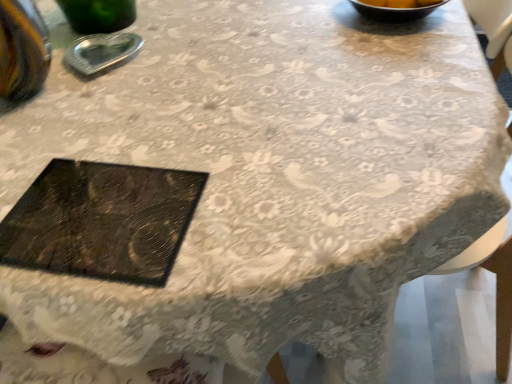
The width and height of the screenshot is (512, 384). Describe the element at coordinates (102, 221) in the screenshot. I see `black textured tray at center` at that location.

Where is `black textured tray at center`? The height and width of the screenshot is (384, 512). black textured tray at center is located at coordinates (102, 221).

What is the approximate height of black textured tray at center?

black textured tray at center is 0.68 inches in height.

The image size is (512, 384). I want to click on metallic silver ashtray at upper left, so click(x=101, y=51).

Describe the element at coordinates (101, 51) in the screenshot. The height and width of the screenshot is (384, 512). I see `metallic silver ashtray at upper left` at that location.

I want to click on black textured tray at center, so click(102, 221).

Looking at this image, between black textured tray at center and metallic silver ashtray at upper left, which one appears on the right side from the viewer's perspective?

black textured tray at center.

Which object is closer to the camera taking this photo, black textured tray at center or metallic silver ashtray at upper left?

black textured tray at center is in front.

Which is closer, [71,175] or [114,55]?

Point [71,175] is positioned closer to the camera compared to point [114,55].

From the image's perspective, which object appears higher, black textured tray at center or metallic silver ashtray at upper left?

metallic silver ashtray at upper left appears higher in the image.

From a real-world perspective, which is physically above, black textured tray at center or metallic silver ashtray at upper left?

metallic silver ashtray at upper left.

Which of these two, black textured tray at center or metallic silver ashtray at upper left, is wider?

With larger width is black textured tray at center.

From the picture: Considering the sizes of objects black textured tray at center and metallic silver ashtray at upper left in the image provided, who is taller, black textured tray at center or metallic silver ashtray at upper left?

With more height is metallic silver ashtray at upper left.

Which of these two, black textured tray at center or metallic silver ashtray at upper left, is bigger?

black textured tray at center.

Is black textured tray at center located outside metallic silver ashtray at upper left?

black textured tray at center is positioned outside metallic silver ashtray at upper left.

Is black textured tray at center positioned far away from metallic silver ashtray at upper left?

No, black textured tray at center is not far from metallic silver ashtray at upper left.

Could you tell me if black textured tray at center is turned towards metallic silver ashtray at upper left?

Yes, black textured tray at center is turned towards metallic silver ashtray at upper left.

Measure the distance from black textured tray at center to metallic silver ashtray at upper left.

A distance of 17.10 inches exists between black textured tray at center and metallic silver ashtray at upper left.

Where is `tray in front of the metallic silver ashtray at upper left`? This screenshot has height=384, width=512. tray in front of the metallic silver ashtray at upper left is located at coordinates (102, 221).

Which is more to the left, metallic silver ashtray at upper left or black textured tray at center?

metallic silver ashtray at upper left is more to the left.

Which is behind, metallic silver ashtray at upper left or black textured tray at center?

Positioned behind is metallic silver ashtray at upper left.

Is point (79, 64) closer to camera compared to point (114, 221)?

That is False.

From the image's perspective, is metallic silver ashtray at upper left under black textured tray at center?

Actually, metallic silver ashtray at upper left appears above black textured tray at center in the image.

From a real-world perspective, is metallic silver ashtray at upper left under black textured tray at center?

No, from a real-world perspective, metallic silver ashtray at upper left is not under black textured tray at center.

Is metallic silver ashtray at upper left wider than black textured tray at center?

No.

Is metallic silver ashtray at upper left taller or shorter than black textured tray at center?

In the image, metallic silver ashtray at upper left appears to be taller than black textured tray at center.

Considering the sizes of objects metallic silver ashtray at upper left and black textured tray at center in the image provided, who is smaller, metallic silver ashtray at upper left or black textured tray at center?

Smaller between the two is metallic silver ashtray at upper left.

Would you say black textured tray at center is part of metallic silver ashtray at upper left's contents?

No, black textured tray at center is located outside of metallic silver ashtray at upper left.

Is metallic silver ashtray at upper left far from black textured tray at center?

That's not correct — metallic silver ashtray at upper left is a little close to black textured tray at center.

Is metallic silver ashtray at upper left facing towards black textured tray at center?

No, metallic silver ashtray at upper left is not oriented towards black textured tray at center.

How different are the orientations of metallic silver ashtray at upper left and black textured tray at center in degrees?

The angle between the facing direction of metallic silver ashtray at upper left and the facing direction of black textured tray at center is 85.3 degrees.

How much distance is there between metallic silver ashtray at upper left and black textured tray at center?

metallic silver ashtray at upper left is 17.10 inches away from black textured tray at center.

You are a GUI agent. You are given a task and a screenshot of the screen. Output one action in this format:
    pyautogui.click(x=<x>, y=<y>)
    Task: Click on the tray on the right of the metallic silver ashtray at upper left
    The width and height of the screenshot is (512, 384).
    Given the screenshot: What is the action you would take?
    102,221

This screenshot has height=384, width=512. In the image, there is a black textured tray at center. Identify the location of tableware above it (from the image's perspective). (101, 51).

Identify the location of tableware to the left of black textured tray at center. This screenshot has height=384, width=512. (101, 51).